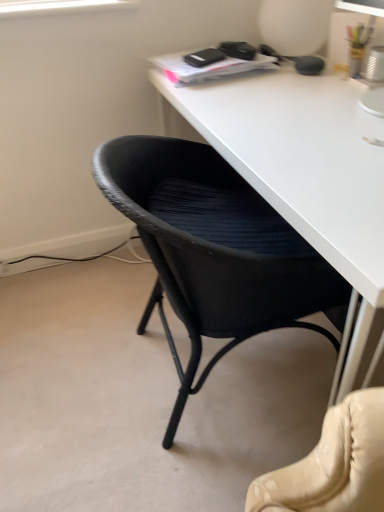
Locate an element on the screen. free spot above black woven chair at center (from a real-world perspective) is located at coordinates (274, 141).